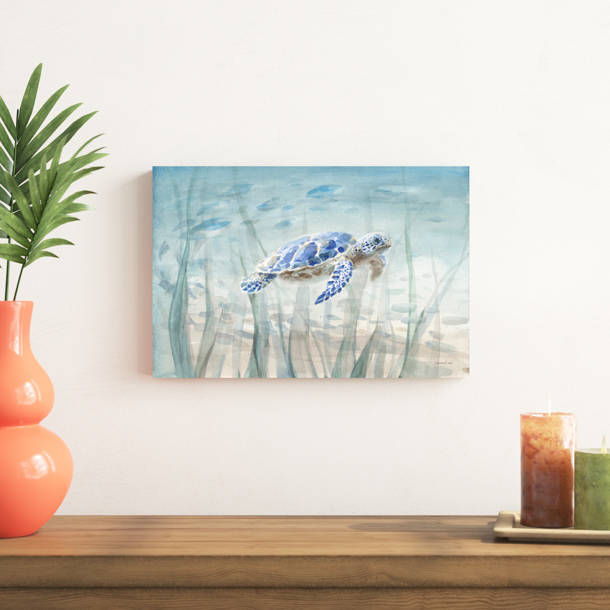
You are a GUI agent. You are given a task and a screenshot of the screen. Output one action in this format:
    pyautogui.click(x=<x>, y=<y>)
    Task: Click on the wall to left of painting
    The width and height of the screenshot is (610, 610).
    Given the screenshot: What is the action you would take?
    pyautogui.click(x=91, y=291)